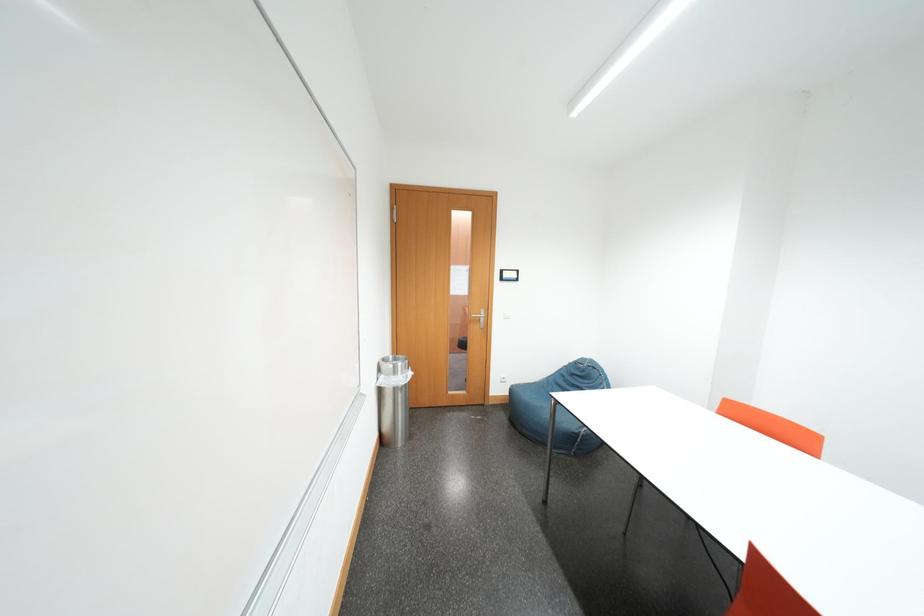
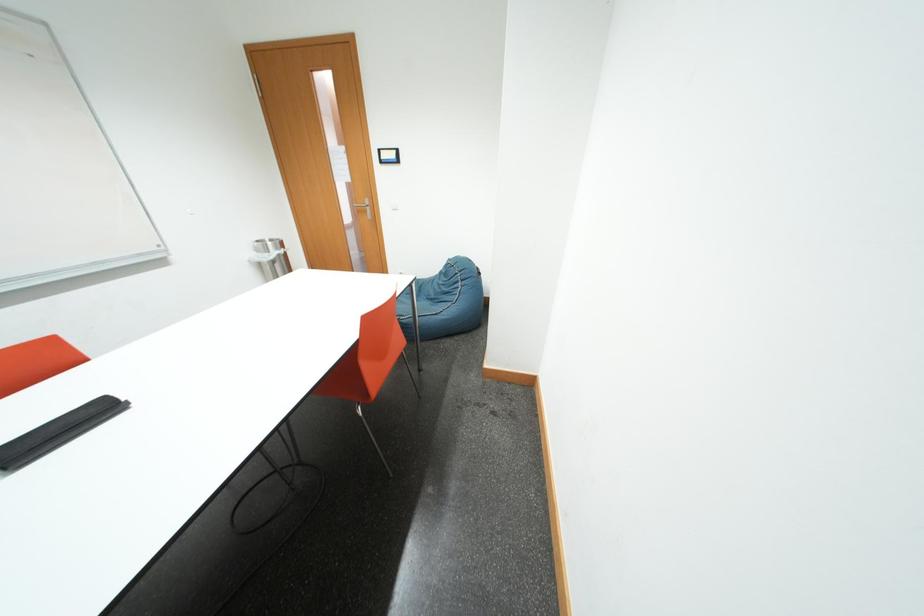
Question: What movement of the cameraman would produce the second image?

Choices:
 (A) Left
 (B) Right
 (C) Forward
 (D) Backward

Answer: (B)